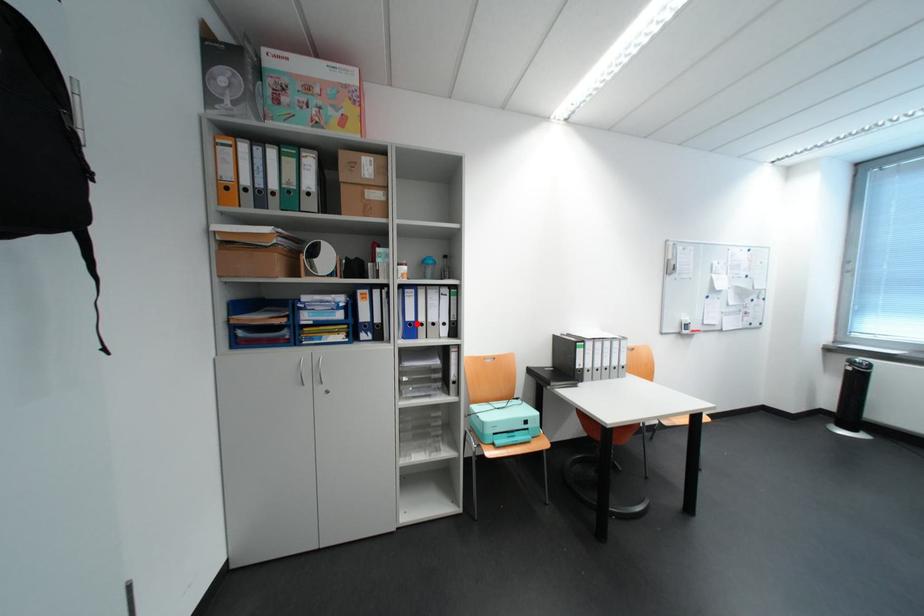
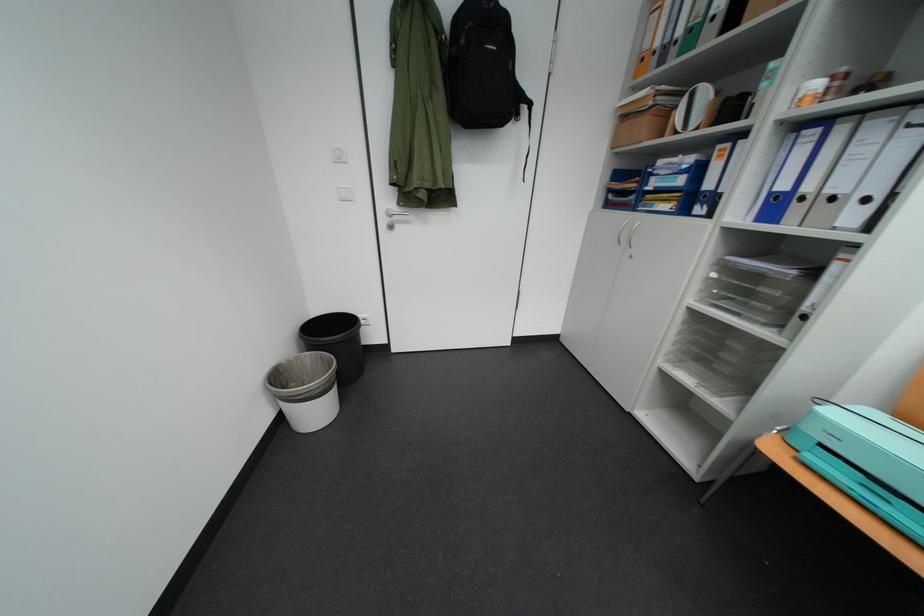
In the second image, find the point that corresponds to the highlighted location in the first image.

(782, 196)